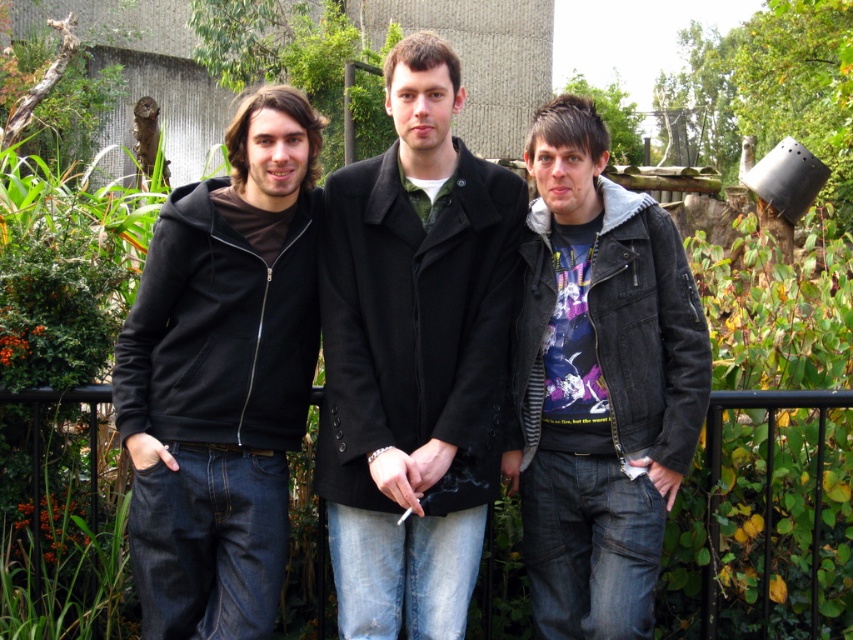
Question: Can you confirm if black wool coat at center is smaller than black metal fence at center?

Choices:
 (A) no
 (B) yes

Answer: (A)

Question: Which point appears farthest from the camera in this image?

Choices:
 (A) (642, 420)
 (B) (152, 552)

Answer: (A)

Question: Does black wool coat at center come behind black matte hoodie at left?

Choices:
 (A) yes
 (B) no

Answer: (B)

Question: Which object appears closest to the camera in this image?

Choices:
 (A) black matte hoodie at left
 (B) black wool coat at center
 (C) denim jacket at center
 (D) black metal fence at center

Answer: (C)

Question: Can you confirm if black matte hoodie at left is thinner than denim jacket at center?

Choices:
 (A) yes
 (B) no

Answer: (B)

Question: Based on their relative distances, which object is nearer to the black matte hoodie at left?

Choices:
 (A) denim jacket at center
 (B) black metal fence at center

Answer: (A)